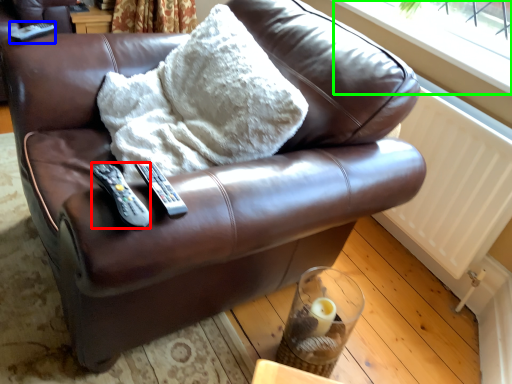
Question: Which object is positioned closest to remote (highlighted by a red box)? Select from remote (highlighted by a blue box) and window frame (highlighted by a green box).

Choices:
 (A) remote
 (B) window frame

Answer: (A)